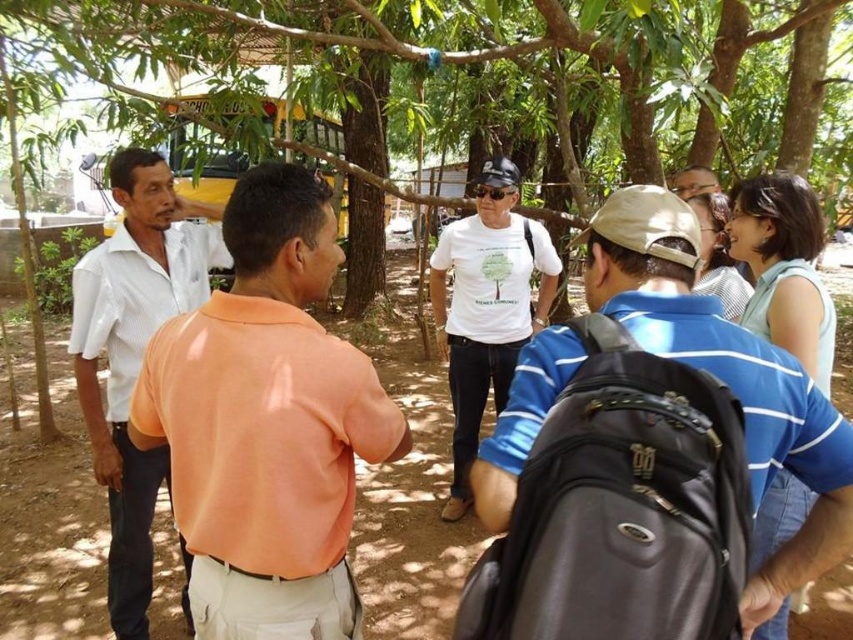
Question: Is white cotton t-shirt at center bigger than beige fabric shirt at upper right?

Choices:
 (A) no
 (B) yes

Answer: (B)

Question: Which point is farther from the camera taking this photo?

Choices:
 (A) (434, 125)
 (B) (126, 524)
 (C) (460, 365)
 (D) (693, 186)

Answer: (A)

Question: Which point is farther from the camera taking this photo?

Choices:
 (A) (273, 406)
 (B) (12, 45)

Answer: (B)

Question: Which of the following is the closest to the observer?

Choices:
 (A) beige fabric shirt at upper right
 (B) white matte t-shirt at center
 (C) white cotton t-shirt at center

Answer: (B)

Question: Can you confirm if brown wood tree at center is bigger than white cotton t-shirt at center?

Choices:
 (A) no
 (B) yes

Answer: (A)

Question: Can you confirm if orange matte shirt at center is bigger than white matte t-shirt at center?

Choices:
 (A) no
 (B) yes

Answer: (B)